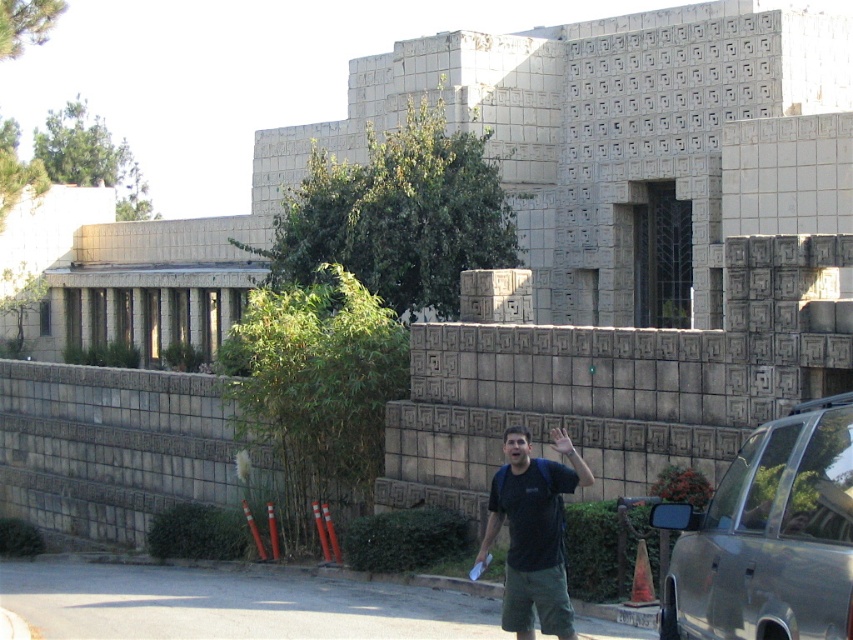
Question: Which point appears farthest from the camera in this image?

Choices:
 (A) (692, 576)
 (B) (561, 438)
 (C) (554, 577)

Answer: (B)

Question: Estimate the real-world distances between objects in this image. Which object is farther from the black fabric shirt at center?

Choices:
 (A) silver metallic car at lower right
 (B) matte black hand at center

Answer: (A)

Question: Can you confirm if silver metallic car at lower right is thinner than matte black hand at center?

Choices:
 (A) no
 (B) yes

Answer: (A)

Question: Among these points, which one is farthest from the camera?

Choices:
 (A) (558, 438)
 (B) (755, 541)
 (C) (535, 582)

Answer: (A)

Question: Is silver metallic car at lower right smaller than black fabric shirt at center?

Choices:
 (A) yes
 (B) no

Answer: (B)

Question: Does black fabric shirt at center lie in front of matte black hand at center?

Choices:
 (A) yes
 (B) no

Answer: (A)